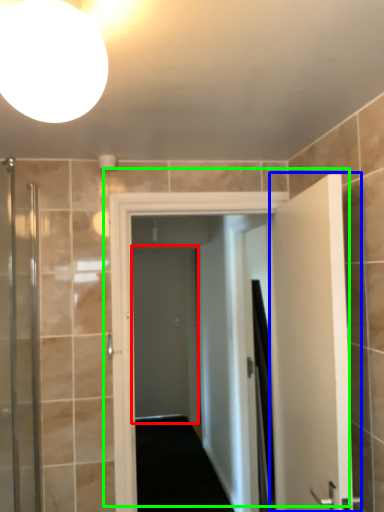
Question: Which object is the closest to the screen door (highlighted by a red box)? Choose among these: door (highlighted by a blue box) or door (highlighted by a green box).

Choices:
 (A) door
 (B) door

Answer: (B)